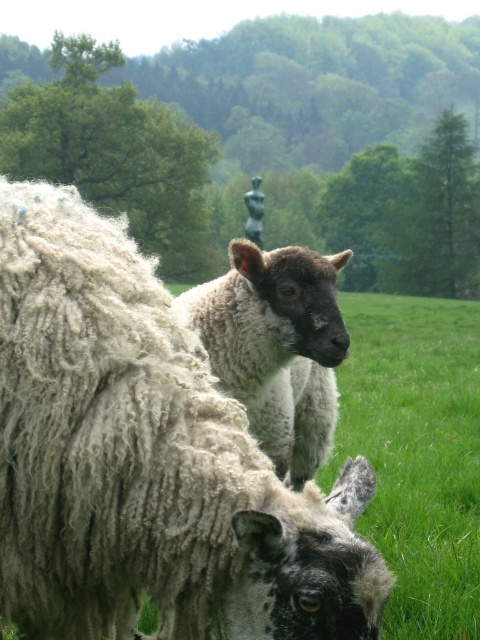
Question: Which point is farther from the camera taking this photo?

Choices:
 (A) (79, 195)
 (B) (334, 378)

Answer: (B)

Question: Which point is closer to the camera?

Choices:
 (A) white woolen lamb at center
 (B) curly woolen sheep at center

Answer: (B)

Question: Is curly woolen sheep at center positioned before white woolen lamb at center?

Choices:
 (A) no
 (B) yes

Answer: (B)

Question: Considering the relative positions of curly woolen sheep at center and white woolen lamb at center in the image provided, where is curly woolen sheep at center located with respect to white woolen lamb at center?

Choices:
 (A) above
 (B) below

Answer: (A)

Question: In this image, where is curly woolen sheep at center located relative to white woolen lamb at center?

Choices:
 (A) above
 (B) below

Answer: (A)

Question: Which object is closer to the camera taking this photo?

Choices:
 (A) curly woolen sheep at center
 (B) white woolen lamb at center

Answer: (A)